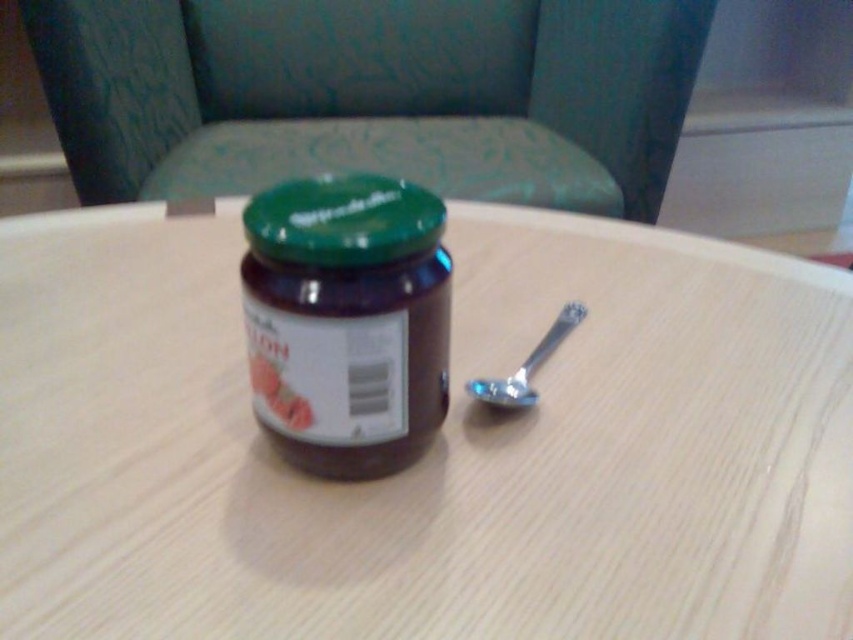
Question: Which object appears closest to the camera in this image?

Choices:
 (A) green matte jar lid at center
 (B) wooden table at center

Answer: (B)

Question: Is wooden table at center above matte glass jar at center?

Choices:
 (A) no
 (B) yes

Answer: (B)

Question: Which object is positioned closest to the wooden table at center?

Choices:
 (A) green matte jar lid at center
 (B) matte glass jar at center
 (C) silver metallic spoon at lower right

Answer: (C)

Question: Which object appears closest to the camera in this image?

Choices:
 (A) matte glass jar at center
 (B) green matte jar lid at center
 (C) silver metallic spoon at lower right

Answer: (A)

Question: Does wooden table at center appear over green matte jar lid at center?

Choices:
 (A) yes
 (B) no

Answer: (B)

Question: Can you confirm if green matte jar lid at center is positioned below silver metallic spoon at lower right?

Choices:
 (A) yes
 (B) no

Answer: (B)